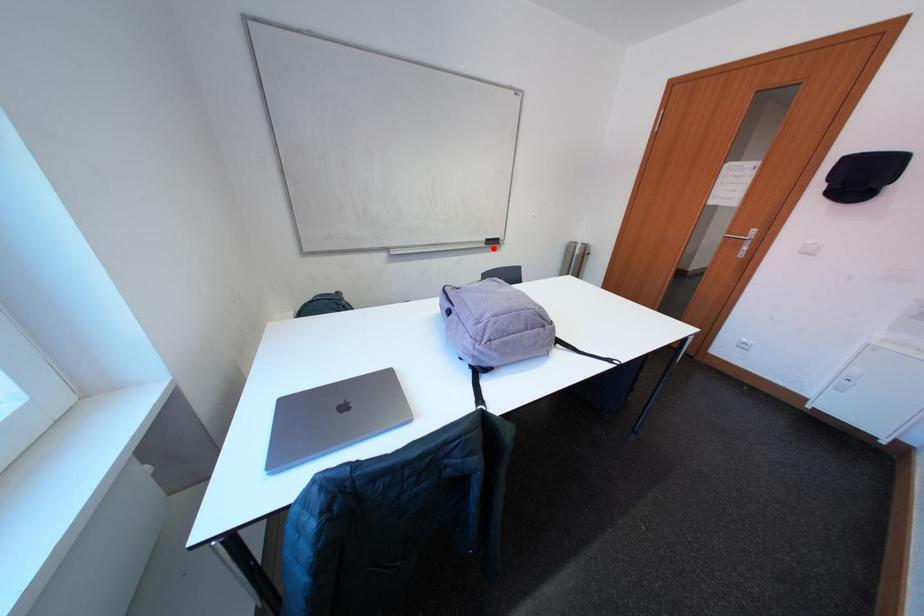
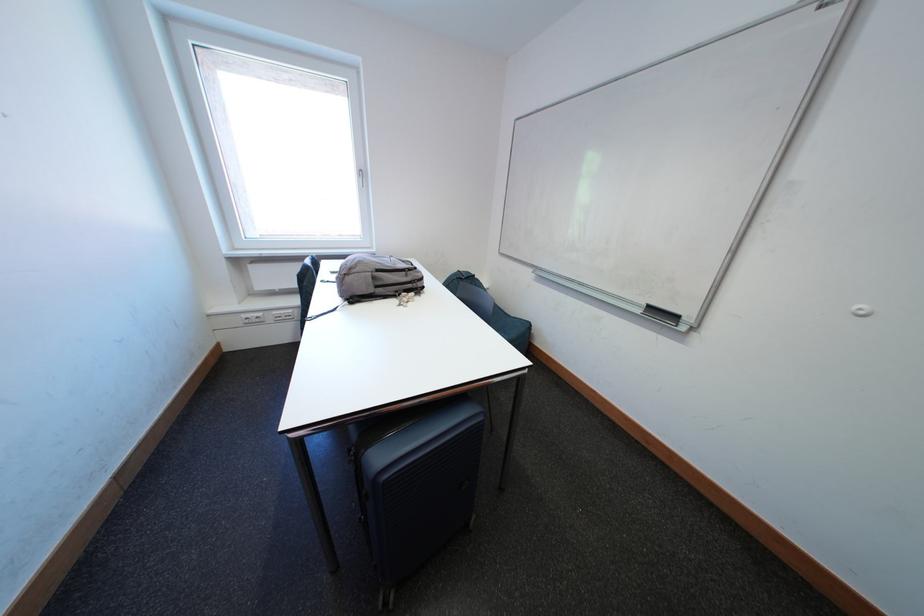
The point at the highlighted location is marked in the first image. Where is the corresponding point in the second image?

(649, 315)